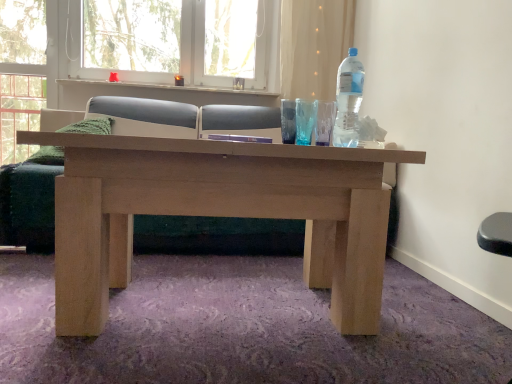
Question: Is the position of translucent fabric curtain at upper center less distant than that of white plastic window frame at upper center?

Choices:
 (A) no
 (B) yes

Answer: (A)

Question: Is translucent fabric curtain at upper center not inside white plastic window frame at upper center?

Choices:
 (A) no
 (B) yes

Answer: (B)

Question: From the image's perspective, would you say translucent fabric curtain at upper center is positioned over white plastic window frame at upper center?

Choices:
 (A) yes
 (B) no

Answer: (B)

Question: Does translucent fabric curtain at upper center come behind white plastic window frame at upper center?

Choices:
 (A) yes
 (B) no

Answer: (A)

Question: Does translucent fabric curtain at upper center appear on the left side of white plastic window frame at upper center?

Choices:
 (A) yes
 (B) no

Answer: (B)

Question: In the image, is white plastic window frame at upper center on the left side or the right side of matte wood couch at center?

Choices:
 (A) left
 (B) right

Answer: (A)

Question: Relative to matte wood couch at center, is white plastic window frame at upper center in front or behind?

Choices:
 (A) behind
 (B) front

Answer: (A)

Question: Considering the positions of white plastic window frame at upper center and matte wood couch at center in the image, is white plastic window frame at upper center taller or shorter than matte wood couch at center?

Choices:
 (A) tall
 (B) short

Answer: (B)

Question: Is white plastic window frame at upper center spatially inside matte wood couch at center, or outside of it?

Choices:
 (A) inside
 (B) outside

Answer: (B)

Question: Considering the positions of transparent plastic bottle at upper right and white plastic window frame at upper center in the image, is transparent plastic bottle at upper right taller or shorter than white plastic window frame at upper center?

Choices:
 (A) short
 (B) tall

Answer: (A)

Question: Based on their sizes in the image, would you say transparent plastic bottle at upper right is bigger or smaller than white plastic window frame at upper center?

Choices:
 (A) big
 (B) small

Answer: (B)

Question: Is transparent plastic bottle at upper right to the left or to the right of white plastic window frame at upper center in the image?

Choices:
 (A) left
 (B) right

Answer: (B)

Question: Is transparent plastic bottle at upper right in front of or behind white plastic window frame at upper center in the image?

Choices:
 (A) front
 (B) behind

Answer: (A)

Question: Is white plastic window frame at upper center inside or outside of white textured window sill at upper center?

Choices:
 (A) outside
 (B) inside

Answer: (A)

Question: Does point (58, 1) appear closer or farther from the camera than point (256, 92)?

Choices:
 (A) farther
 (B) closer

Answer: (B)